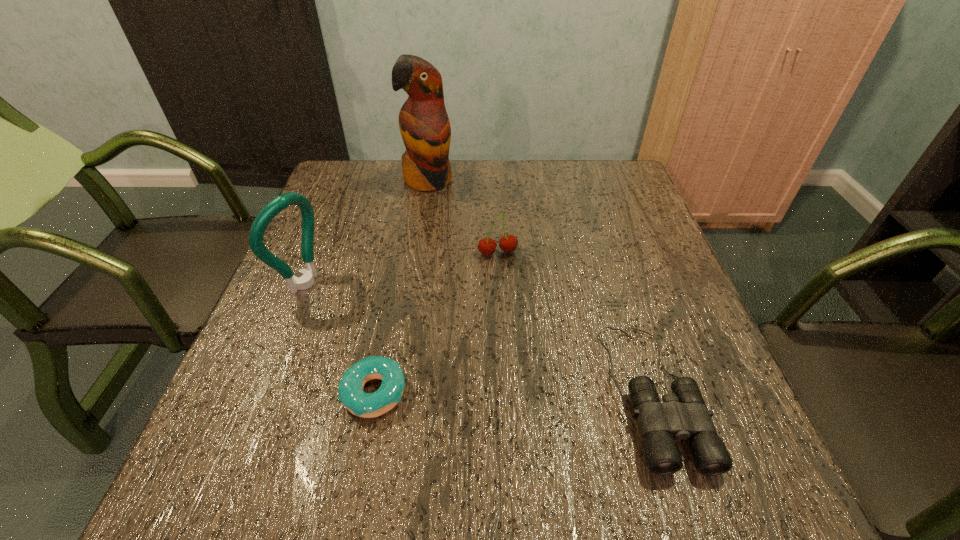
At what (x,y) coordinates should I click in order to perform the action: click on vacant space on the desktop that is between the shortest object and the rightmost object and is positioned on the surface of the fourth nearest object. Please return your answer as a coordinate pair (x, y). Looking at the image, I should click on (538, 392).

This screenshot has height=540, width=960. Find the location of `free space on the desktop that is between the doughnut and the binoculars and is positioned at the jaws of the third farthest object`. free space on the desktop that is between the doughnut and the binoculars and is positioned at the jaws of the third farthest object is located at coordinates (519, 392).

Identify the location of vacant spot on the desktop that is between the shortest object and the binoculars and is positioned on the face of the farthest object. (519, 392).